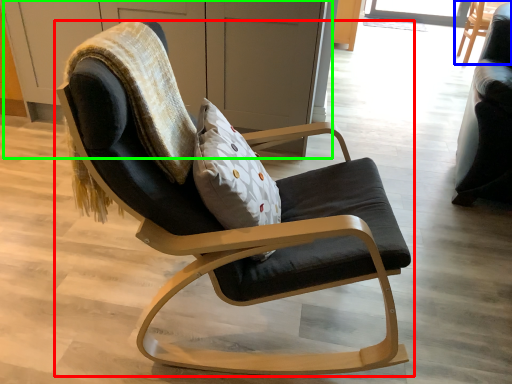
Question: Based on their relative distances, which object is farther from chair (highlighted by a red box)? Choose from chair (highlighted by a blue box) and dresser (highlighted by a green box).

Choices:
 (A) chair
 (B) dresser

Answer: (A)